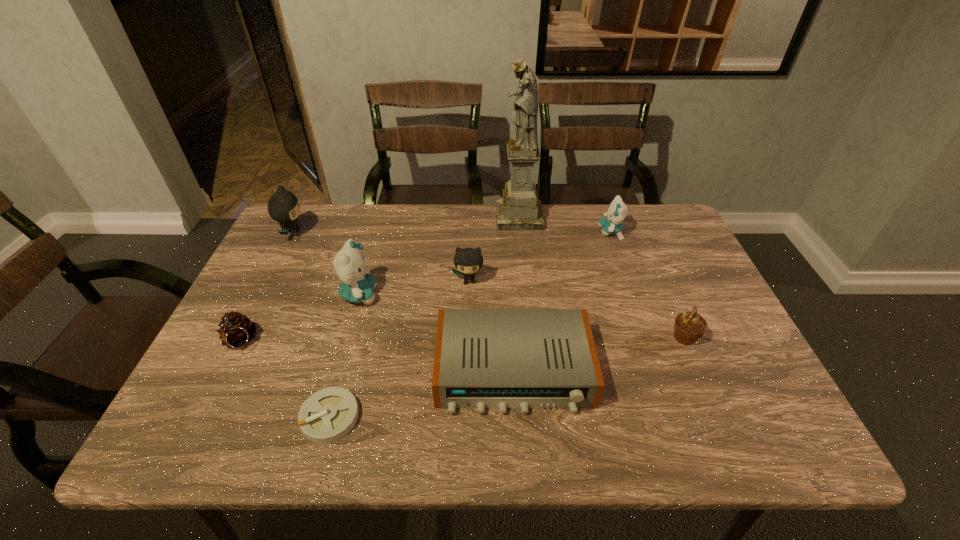
Locate an element on the screen. gray sculpture is located at coordinates [519, 209].

I want to click on the tallest object, so click(519, 209).

Locate an element on the screen. This screenshot has height=540, width=960. the nearer blue kitten is located at coordinates (357, 285).

This screenshot has width=960, height=540. What are the coordinates of `the bigger blue kitten` in the screenshot? It's located at (357, 285).

Where is `the leftmost kitten`? This screenshot has width=960, height=540. the leftmost kitten is located at coordinates (283, 207).

Where is `the left gray kitten`? Image resolution: width=960 pixels, height=540 pixels. the left gray kitten is located at coordinates (283, 207).

Locate an element on the screen. This screenshot has height=540, width=960. the right blue kitten is located at coordinates (617, 211).

The width and height of the screenshot is (960, 540). Find the location of `the farther blue kitten`. the farther blue kitten is located at coordinates (617, 211).

This screenshot has width=960, height=540. In order to click on the smaller gray kitten in this screenshot , I will do `click(468, 261)`.

Identify the location of the nearer gray kitten. (468, 261).